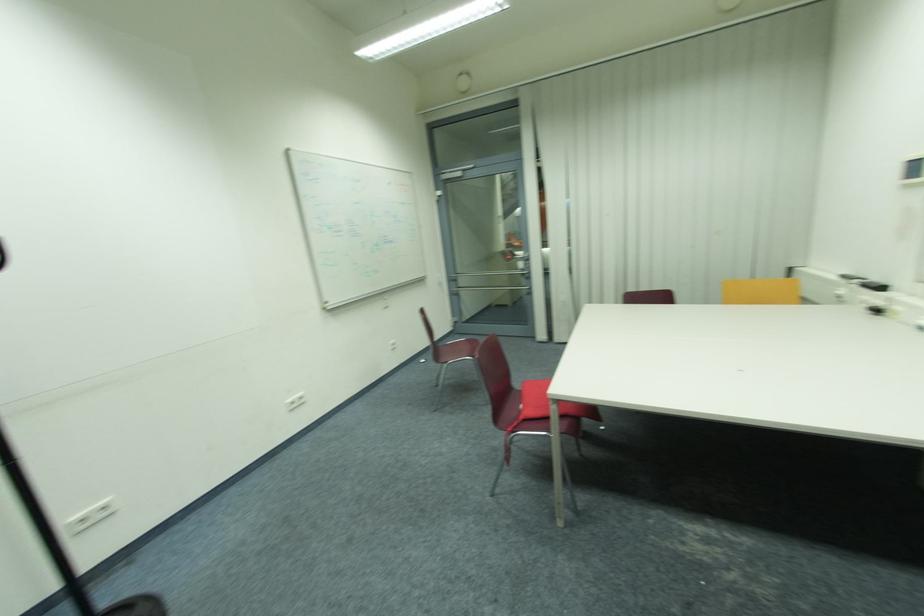
Where would you pull the vertical door handle? Please return your answer as a coordinate pair (x, y).

(515, 256)